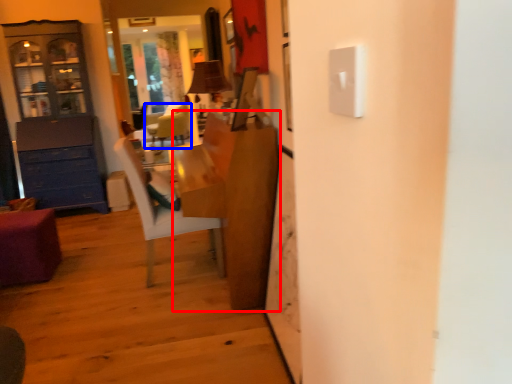
Question: Which object is closer to the camera taking this photo, table (highlighted by a red box) or chair (highlighted by a blue box)?

Choices:
 (A) table
 (B) chair

Answer: (A)